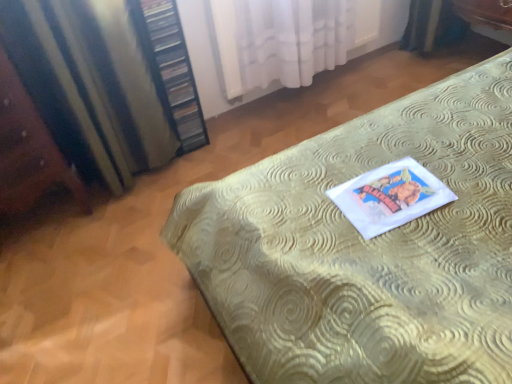
You are a GUI agent. You are given a task and a screenshot of the screen. Output one action in this format:
    pyautogui.click(x=<x>, y=<y>)
    Task: Click on the empty space that is to the right of brown wooden vanity at left
    The width and height of the screenshot is (512, 384).
    Given the screenshot: What is the action you would take?
    pyautogui.click(x=116, y=230)